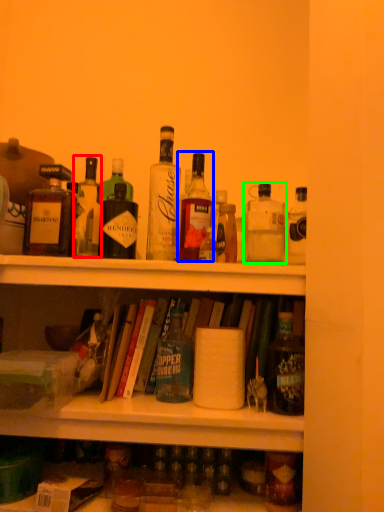
Question: Estimate the real-world distances between objects in this image. Which object is closer to bottle (highlighted by a red box), bottle (highlighted by a blue box) or bottle (highlighted by a green box)?

Choices:
 (A) bottle
 (B) bottle

Answer: (A)